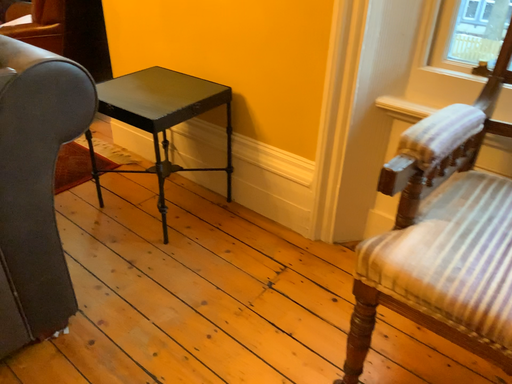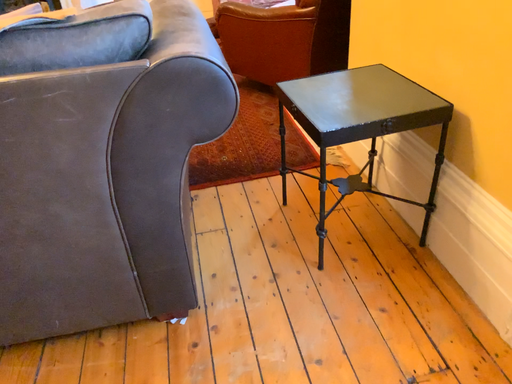
Question: How did the camera likely rotate when shooting the video?

Choices:
 (A) rotated right
 (B) rotated left

Answer: (B)